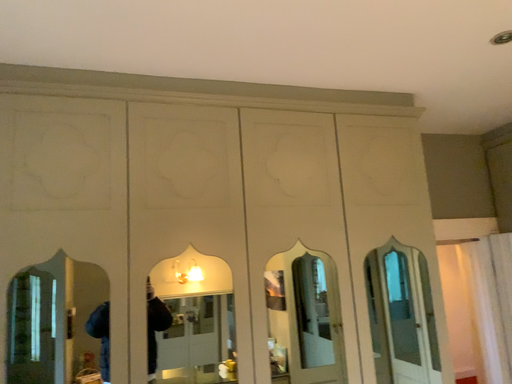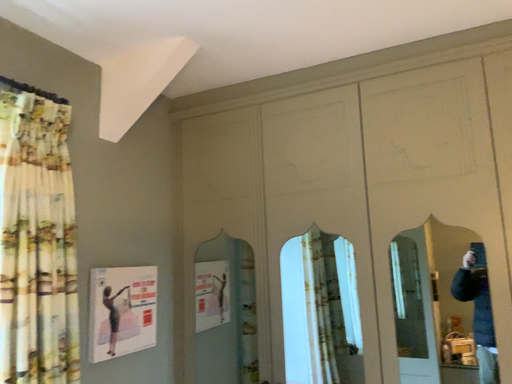
Question: Which way did the camera rotate in the video?

Choices:
 (A) rotated downward
 (B) rotated upward

Answer: (A)